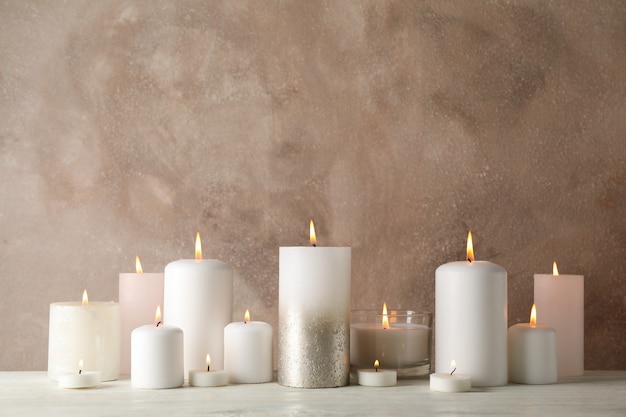
Where is `small white candle disc`? The height and width of the screenshot is (417, 626). small white candle disc is located at coordinates (71, 379), (212, 376), (384, 381), (453, 385).